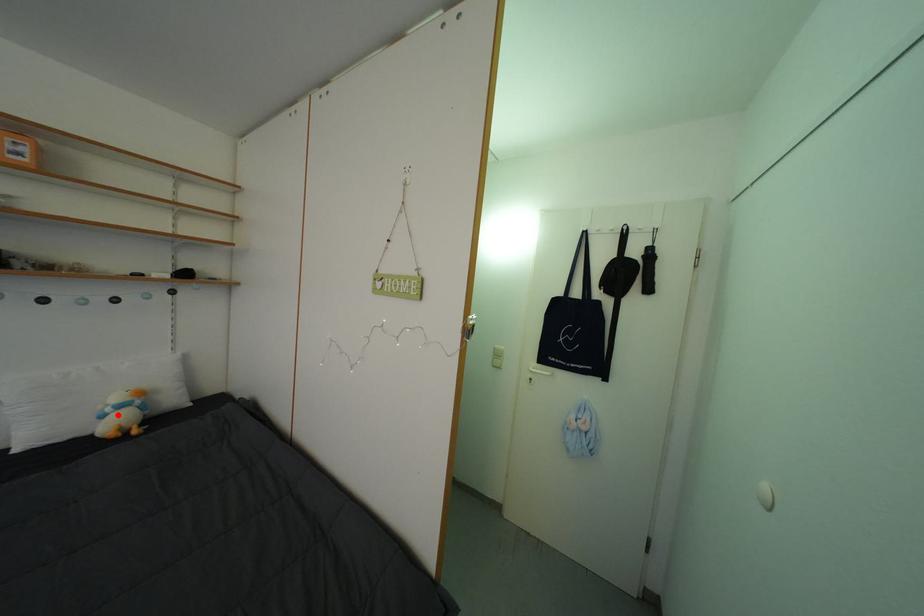
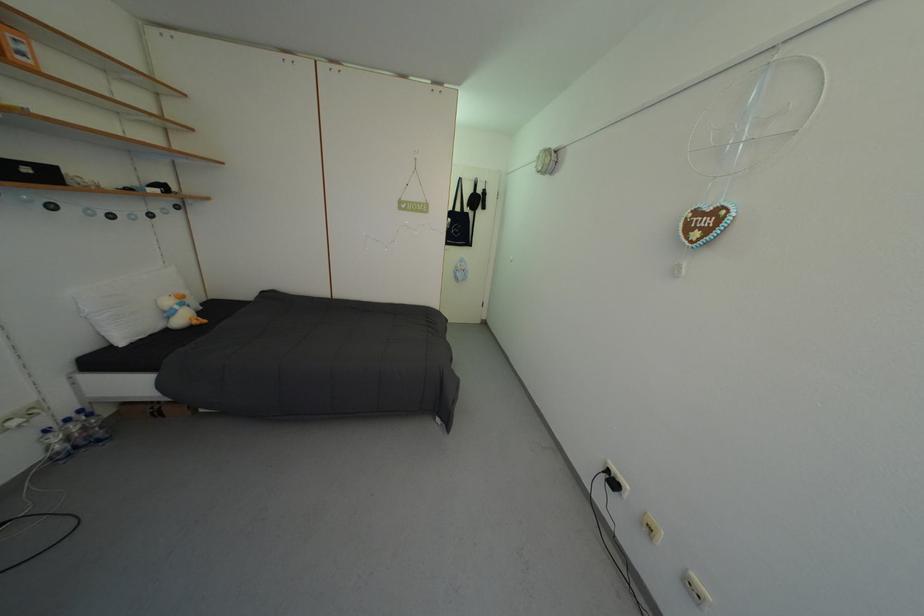
Question: I am providing you with two images of the same scene from different viewpoints. A red point is shown in image1. For the corresponding object point in image2, is it positioned nearer or farther from the camera?

Choices:
 (A) Nearer
 (B) Farther

Answer: (B)